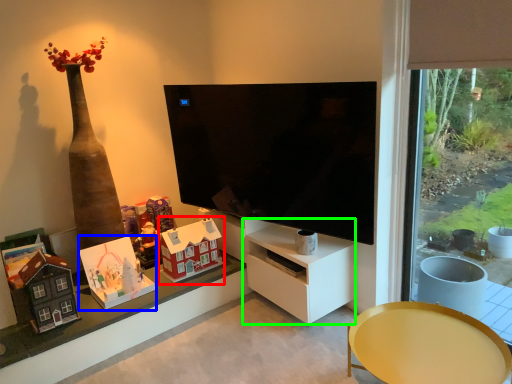
Question: Considering the real-world distances, which object is closest to toy (highlighted by a red box)? toy (highlighted by a blue box) or tv cabinet (highlighted by a green box).

Choices:
 (A) toy
 (B) tv cabinet

Answer: (A)